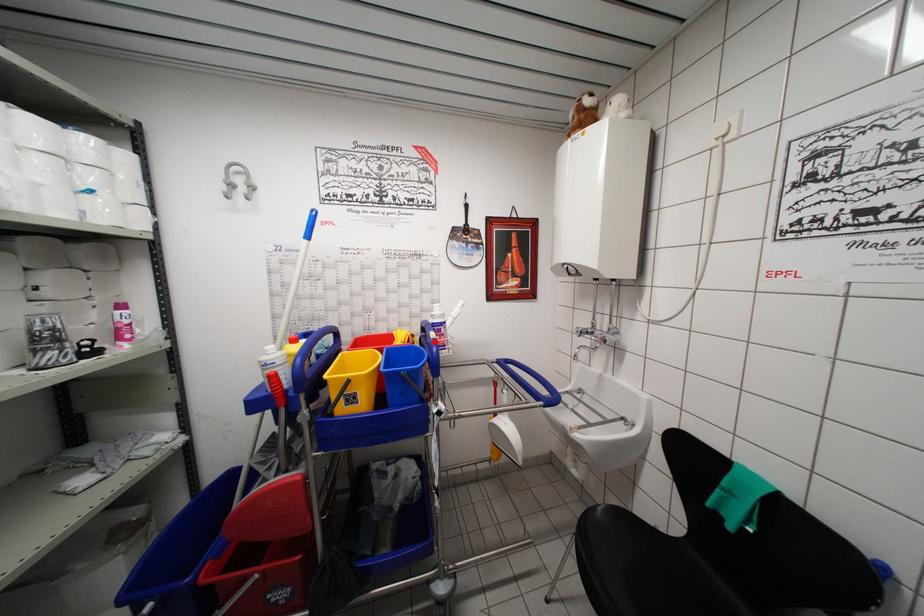
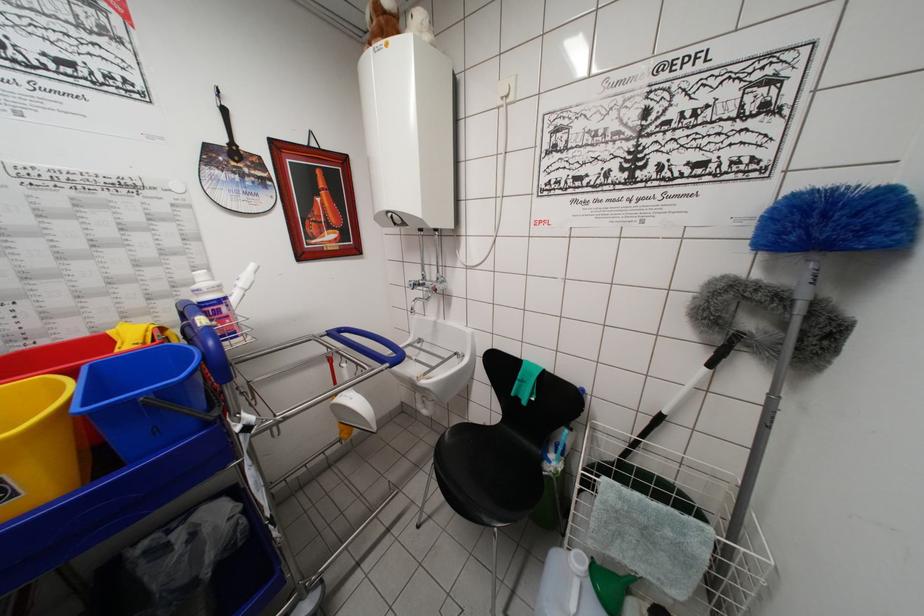
Locate, in the second image, the point that corresponds to the highlighted location in the first image.

(202, 330)